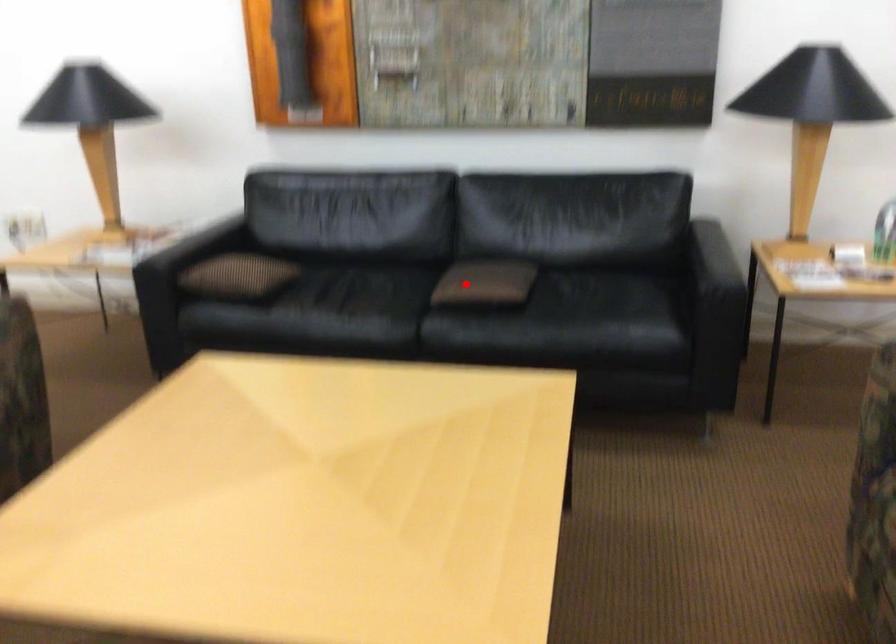
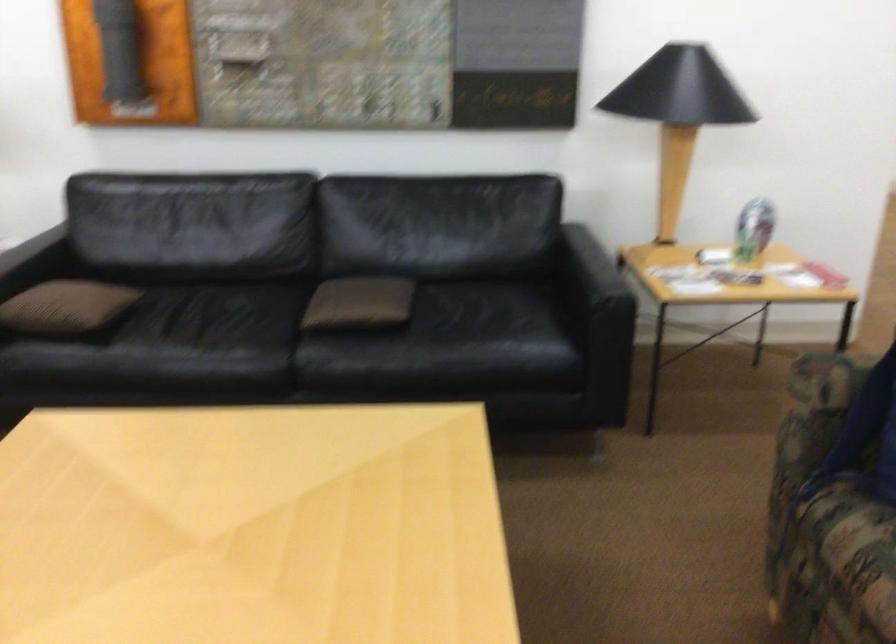
Question: A red point is marked in image1. In image2, is the corresponding 3D point closer to the camera or farther? Reply with the corresponding letter.

Choices:
 (A) The corresponding 3D point is closer.
 (B) The corresponding 3D point is farther.

Answer: (A)